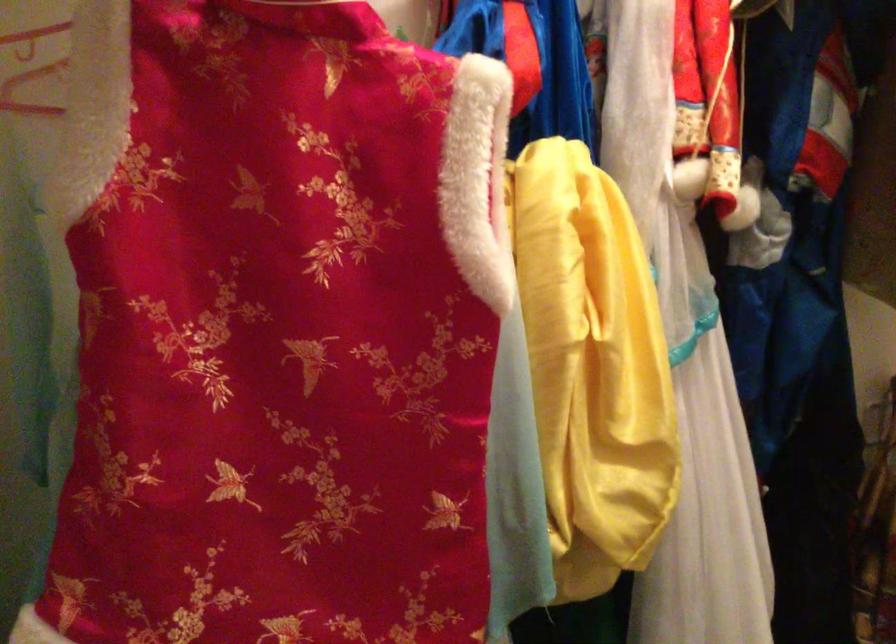
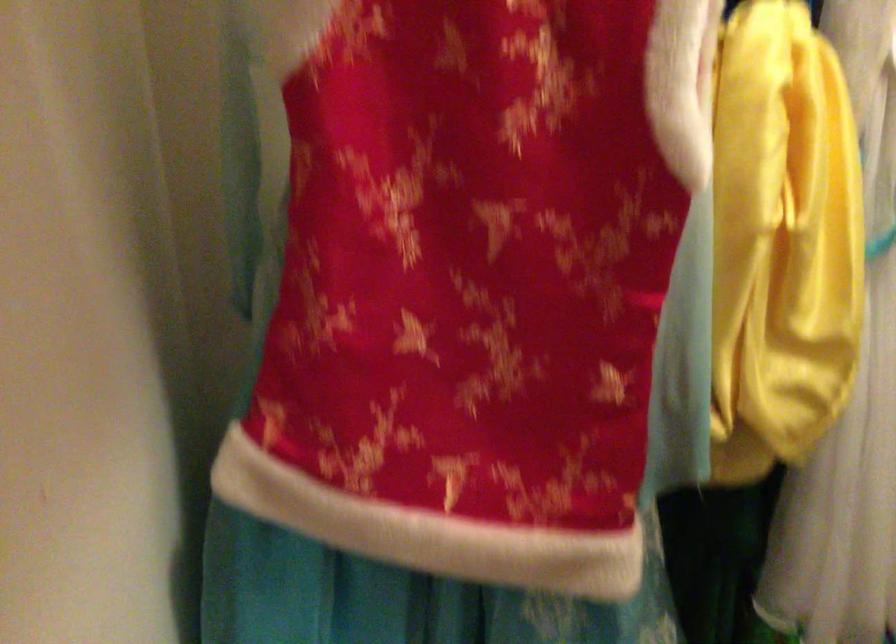
Question: The first image is from the beginning of the video and the second image is from the end. How did the camera likely rotate when shooting the video?

Choices:
 (A) Left
 (B) Right
 (C) Up
 (D) Down

Answer: (D)